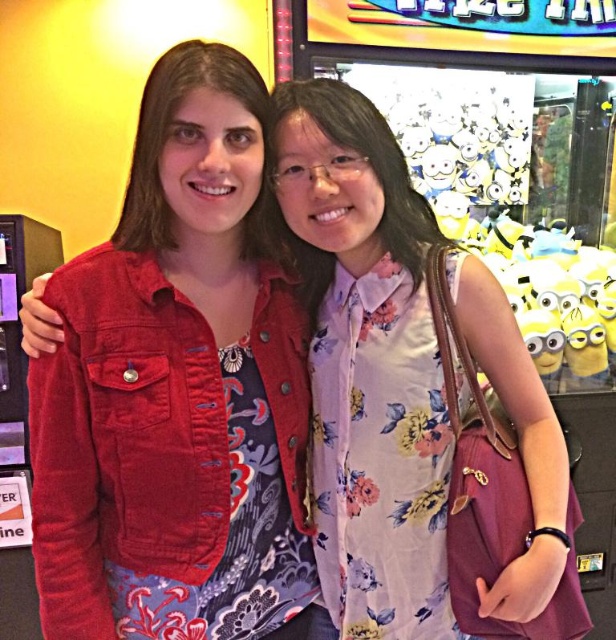
You are a photographer positioned behind the two people in the scene. You want to take a photo focusing on the floral fabric dress at center without the matte red jacket at center blocking the view. Is the position of the two objects such that you can achieve this?

The matte red jacket at center is closer to the viewer than the floral fabric dress at center, so the jacket would block the view of the dress. You cannot take a clear photo of the floral fabric dress at center without the matte red jacket at center blocking it.

You are a photographer trying to capture both the matte red jacket at center and the floral fabric dress at center in a single frame. Since the camera has a limited focus range, which object should you prioritize to ensure it appears sharp?

The matte red jacket at center is bigger than the floral fabric dress at center, so you should prioritize focusing on the matte red jacket at center to ensure it appears sharp in the photo.

You are standing in an arcade and want to place a new poster between the two points, point [233,556] and point [431,330]. Which point should the poster be closer to so it appears larger to someone looking at it from the front?

The poster should be placed closer to point [233,556] because it is closer to the viewer, making the poster appear larger when viewed from the front.